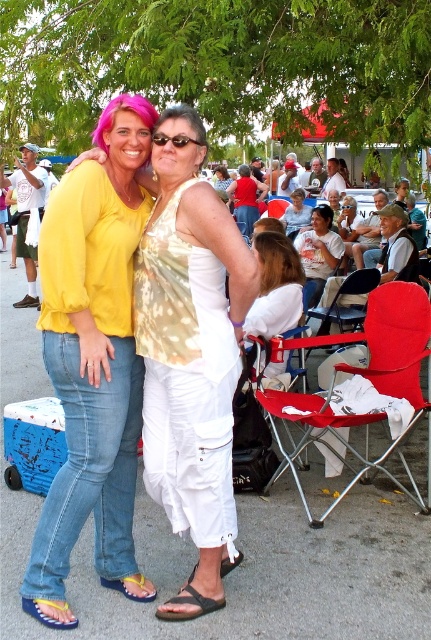
Question: Which point is farther to the camera?

Choices:
 (A) (147, 600)
 (B) (393, 378)

Answer: (B)

Question: Can you confirm if red fabric folding chair at lower right is positioned above blue fabric sandal at lower left?

Choices:
 (A) yes
 (B) no

Answer: (A)

Question: Does green leafy tree at upper center have a larger size compared to yellow fabric sandal at lower left?

Choices:
 (A) yes
 (B) no

Answer: (A)

Question: Does matte yellow blouse at center appear on the left side of white cotton shirt at center?

Choices:
 (A) yes
 (B) no

Answer: (A)

Question: Which point appears closest to the camera in this image?

Choices:
 (A) (419, 61)
 (B) (115, 586)
 (C) (412, 333)
 (D) (99, 268)

Answer: (D)

Question: Which object appears closest to the camera in this image?

Choices:
 (A) blue fabric sandal at lower left
 (B) yellow fabric sandal at lower left
 (C) green leafy tree at upper center

Answer: (A)